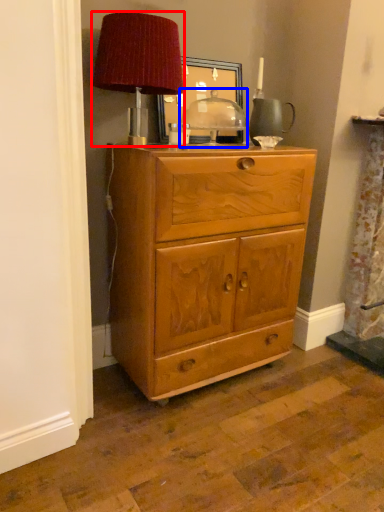
Question: Which point is further to the camera, table lamp (highlighted by a red box) or table (highlighted by a blue box)?

Choices:
 (A) table lamp
 (B) table

Answer: (B)